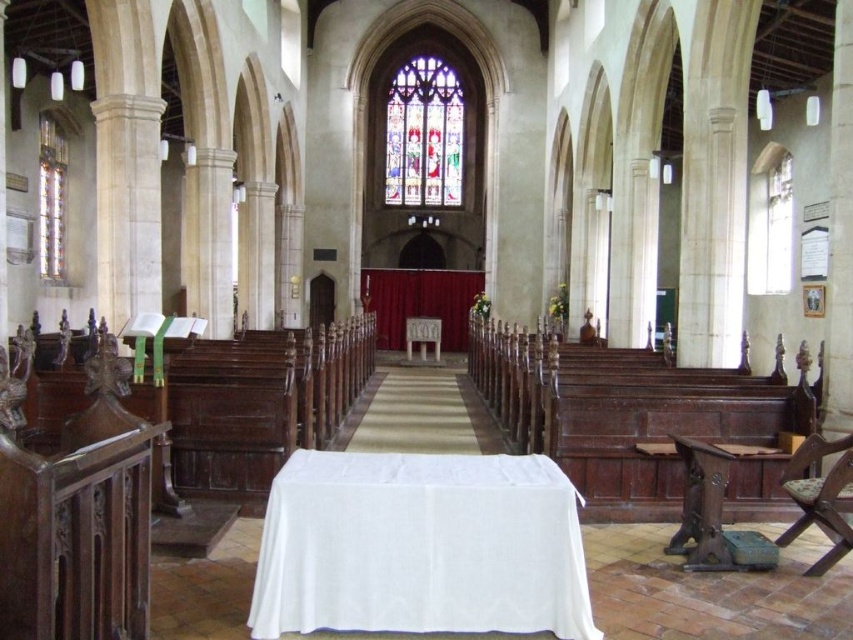
Question: Which of the following is the closest to the observer?

Choices:
 (A) (410, 326)
 (B) (577, 572)

Answer: (B)

Question: Which point is closer to the camera?

Choices:
 (A) coord(44,150)
 (B) coord(503,616)
 (C) coord(698,480)
 (D) coord(842,499)

Answer: (B)

Question: Does clear glass stained glass window at left have a larger size compared to white marble altar at center?

Choices:
 (A) yes
 (B) no

Answer: (B)

Question: Does dark brown wooden chair at lower right have a greater width compared to clear glass stained glass window at left?

Choices:
 (A) yes
 (B) no

Answer: (A)

Question: Which is nearer to the white marble altar at center?

Choices:
 (A) stained glass window at center
 (B) white cloth at center
 (C) wooden chair at right
 (D) dark brown wooden chair at lower right

Answer: (A)

Question: Is white cloth at center behind stained glass window at center?

Choices:
 (A) no
 (B) yes

Answer: (A)